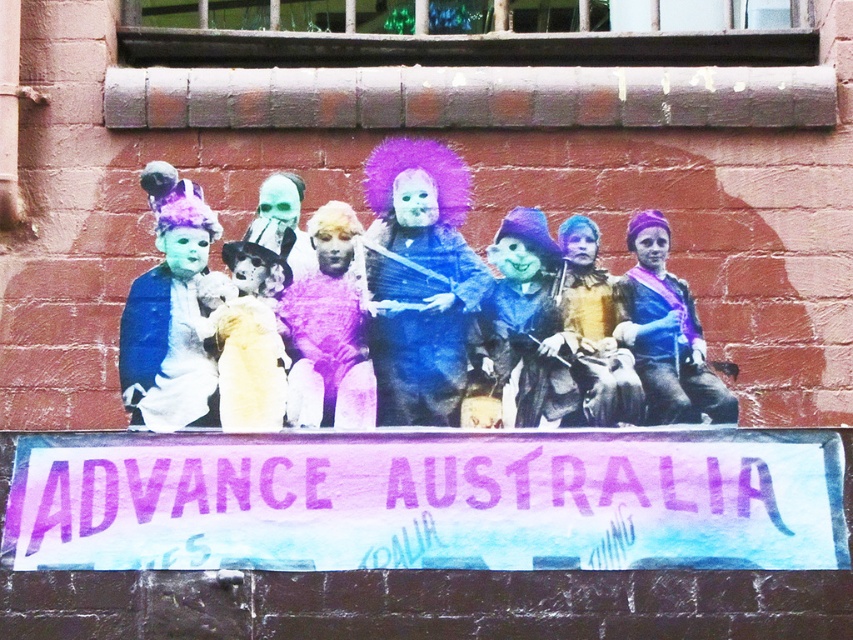
Question: Can you confirm if matte blue costume at center is bigger than fuzzy blue doll at center?

Choices:
 (A) no
 (B) yes

Answer: (B)

Question: Which object is the farthest from the matte blue fabric at center?

Choices:
 (A) blue matte witch hat at center
 (B) blonde synthetic wig at center
 (C) matte blue fabric at left

Answer: (C)

Question: Which of the following is the farthest from the observer?

Choices:
 (A) (260, 262)
 (B) (416, 291)

Answer: (A)

Question: Is fuzzy blue doll at center closer to the viewer compared to matte yellow dress at center?

Choices:
 (A) yes
 (B) no

Answer: (A)

Question: Which point is farther from the camera taking this photo?

Choices:
 (A) (286, 227)
 (B) (518, 298)
 (C) (148, 330)
 (D) (633, 273)

Answer: (A)

Question: Is fuzzy blue doll at center below matte blue fabric at left?

Choices:
 (A) yes
 (B) no

Answer: (B)